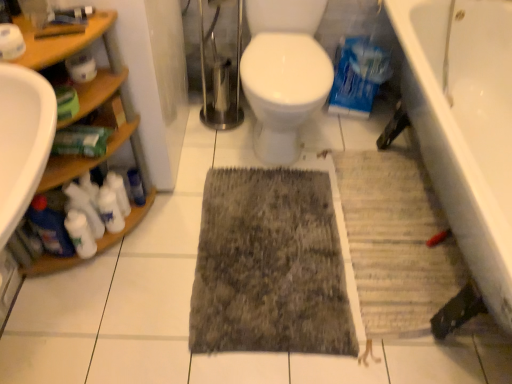
Find the location of a particular element. The height and width of the screenshot is (384, 512). free space between woodenshelves at left and dark gray textured rug at center is located at coordinates (158, 262).